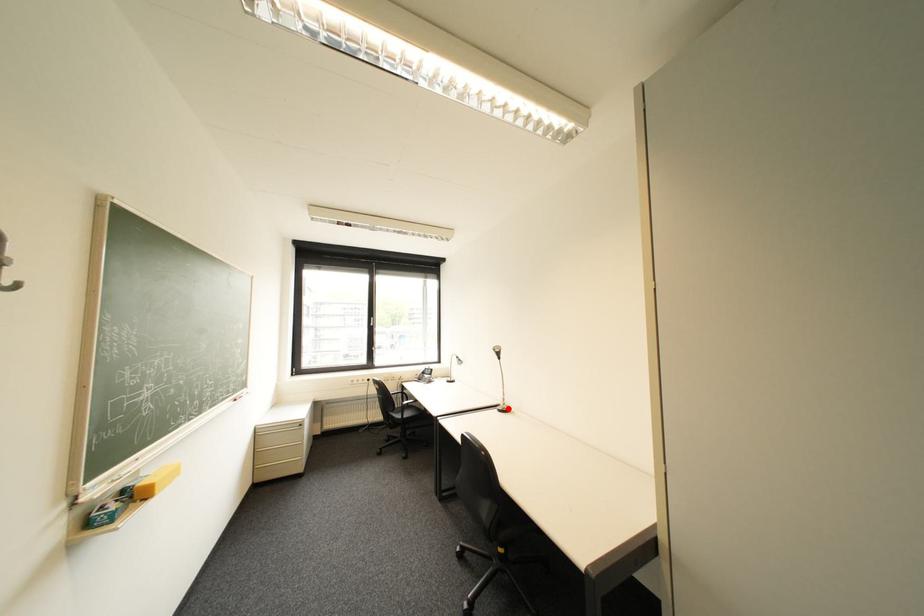
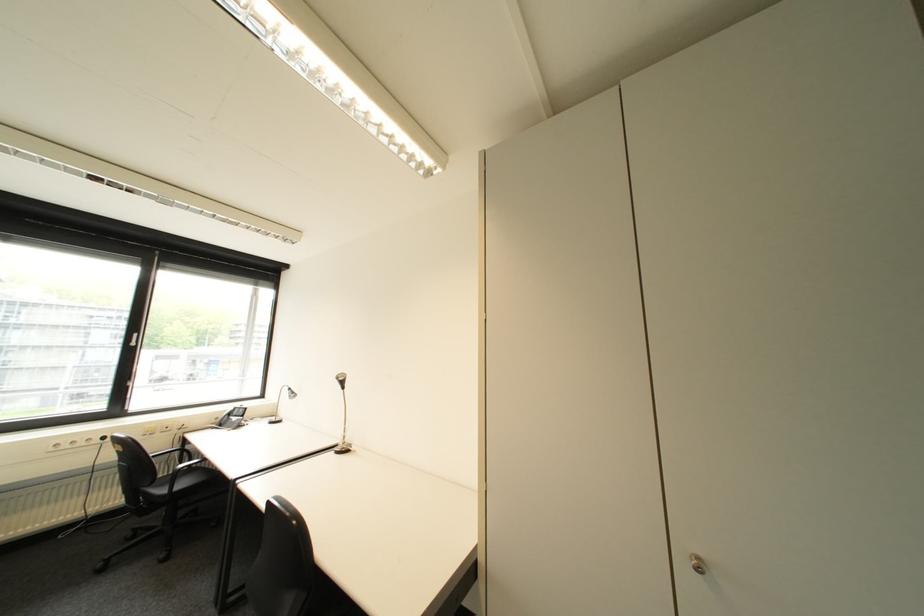
In the second image, find the point that corresponds to the highlighted location in the first image.

(346, 450)